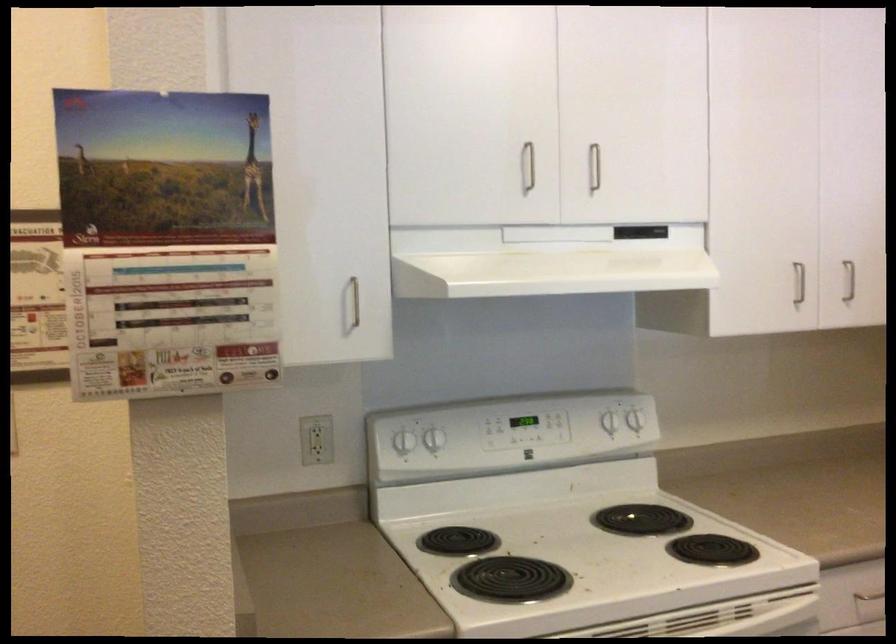
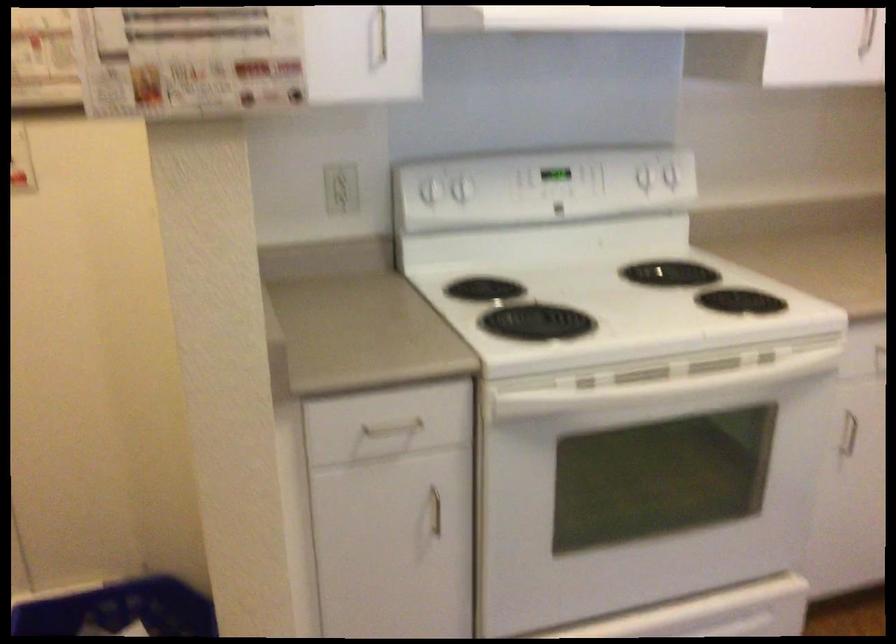
Question: How did the camera likely rotate?

Choices:
 (A) Left
 (B) Right
 (C) Up
 (D) Down

Answer: (D)